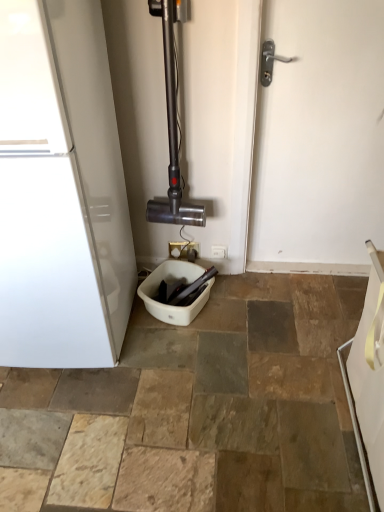
This screenshot has height=512, width=384. I want to click on metallic vacuum cleaner at center, so click(173, 124).

How much space does white plastic electric outlet at center, which is counted as the first electric outlet, starting from the left, occupy horizontally?

The width of white plastic electric outlet at center, which is counted as the first electric outlet, starting from the left, is 0.39 inches.

Locate an element on the screen. The height and width of the screenshot is (512, 384). white plastic electric outlet at center, the 2th electric outlet from the left is located at coordinates (219, 252).

Based on the photo, in order to face white plastic toilet bowl at center, should I rotate leftwards or rightwards?

To align with it, rotate left about 2.483°.

Image resolution: width=384 pixels, height=512 pixels. Identify the location of metallic vacuum cleaner at center. (173, 124).

Find the location of `home appliance located above the white plastic electric outlet at center, the second electric outlet positioned from the right (from a real-world perspective)`. home appliance located above the white plastic electric outlet at center, the second electric outlet positioned from the right (from a real-world perspective) is located at coordinates (60, 190).

In the image, is white plastic electric outlet at center, which is counted as the first electric outlet, starting from the left, positioned in front of or behind white glossy refrigerator at left?

white plastic electric outlet at center, which is counted as the first electric outlet, starting from the left, is behind white glossy refrigerator at left.

From a real-world perspective, between white plastic electric outlet at center, which is counted as the first electric outlet, starting from the left, and white glossy refrigerator at left, who is vertically higher?

From a 3D spatial view, white glossy refrigerator at left is above.

Where is `the 1st electric outlet directly beneath the white matte door at center (from a real-world perspective)`? Image resolution: width=384 pixels, height=512 pixels. the 1st electric outlet directly beneath the white matte door at center (from a real-world perspective) is located at coordinates (184, 250).

Considering the sizes of objects white plastic electric outlet at center, which is counted as the first electric outlet, starting from the left, and white matte door at center in the image provided, who is bigger, white plastic electric outlet at center, which is counted as the first electric outlet, starting from the left, or white matte door at center?

Bigger between the two is white matte door at center.

Would you say white matte door at center is part of white plastic electric outlet at center, the second electric outlet positioned from the right,'s contents?

No, white matte door at center is located outside of white plastic electric outlet at center, the second electric outlet positioned from the right.

Can you tell me how much white plastic electric outlet at center, which is counted as the first electric outlet, starting from the left, and white matte door at center differ in facing direction?

white plastic electric outlet at center, which is counted as the first electric outlet, starting from the left, and white matte door at center are facing 0.605 degrees away from each other.

Is white matte door at center directly adjacent to white glossy refrigerator at left?

No, white matte door at center is not making contact with white glossy refrigerator at left.

From the picture: From the image's perspective, which is above, white matte door at center or white glossy refrigerator at left?

From the image's view, white matte door at center is above.

Is white matte door at center in front of white glossy refrigerator at left?

No, white matte door at center is further to the viewer.

Could you tell me if white matte door at center is turned towards white glossy refrigerator at left?

No, white matte door at center does not turn towards white glossy refrigerator at left.

Are metallic vacuum cleaner at center and white plastic electric outlet at center, the first electric outlet positioned from the right, beside each other?

No.

Looking at their sizes, would you say metallic vacuum cleaner at center is wider or thinner than white plastic electric outlet at center, the first electric outlet positioned from the right?

In the image, metallic vacuum cleaner at center appears to be wider than white plastic electric outlet at center, the first electric outlet positioned from the right.

Which of these two, metallic vacuum cleaner at center or white plastic electric outlet at center, the first electric outlet positioned from the right, is smaller?

Smaller between the two is white plastic electric outlet at center, the first electric outlet positioned from the right.

Could you tell me if metallic vacuum cleaner at center is turned towards white plastic electric outlet at center, the first electric outlet positioned from the right?

No, metallic vacuum cleaner at center is not oriented towards white plastic electric outlet at center, the first electric outlet positioned from the right.

From the image's perspective, which object appears higher, white plastic electric outlet at center, the first electric outlet positioned from the right, or white plastic toilet bowl at center?

white plastic electric outlet at center, the first electric outlet positioned from the right, appears higher in the image.

From a real-world perspective, which object stands above the other?

white plastic electric outlet at center, the 2th electric outlet from the left, from a real-world perspective.

Would you say white plastic electric outlet at center, the 2th electric outlet from the left, is outside white plastic toilet bowl at center?

Indeed, white plastic electric outlet at center, the 2th electric outlet from the left, is completely outside white plastic toilet bowl at center.

Which of these two, white plastic electric outlet at center, the first electric outlet positioned from the right, or white plastic toilet bowl at center, is smaller?

white plastic electric outlet at center, the first electric outlet positioned from the right, is smaller.

Identify the location of toilet bowl below the metallic vacuum cleaner at center (from the image's perspective). coord(170,305).

Does metallic vacuum cleaner at center come in front of white plastic toilet bowl at center?

Yes, metallic vacuum cleaner at center is in front of white plastic toilet bowl at center.

From the image's perspective, which is below, metallic vacuum cleaner at center or white plastic toilet bowl at center?

From the image's view, white plastic toilet bowl at center is below.

In the image, is metallic vacuum cleaner at center on the left side or the right side of white plastic toilet bowl at center?

metallic vacuum cleaner at center is positioned on white plastic toilet bowl at center's left side.

Considering the sizes of white glossy towel at lower right and white glossy refrigerator at left in the image, is white glossy towel at lower right bigger or smaller than white glossy refrigerator at left?

In the image, white glossy towel at lower right appears to be smaller than white glossy refrigerator at left.

Based on the photo, who is more distant, white glossy towel at lower right or white glossy refrigerator at left?

white glossy refrigerator at left is more distant.

What are the coordinates of `home appliance on the left side of white glossy towel at lower right` in the screenshot? It's located at (60, 190).

Which point is more distant from viewer, (376, 414) or (35, 45)?

Positioned behind is point (376, 414).

Where is `home appliance in front of the white plastic electric outlet at center, the second electric outlet positioned from the right`? The height and width of the screenshot is (512, 384). home appliance in front of the white plastic electric outlet at center, the second electric outlet positioned from the right is located at coordinates (60, 190).

At what (x,y) coordinates should I click in order to perform the action: click on door lying on the right of white plastic electric outlet at center, which is counted as the first electric outlet, starting from the left. Please return your answer as a coordinate pair (x, y). The width and height of the screenshot is (384, 512). Looking at the image, I should click on (320, 137).

Considering their positions, is white glossy refrigerator at left positioned further to metallic vacuum cleaner at center than white plastic toilet bowl at center?

The object further to metallic vacuum cleaner at center is white glossy refrigerator at left.

Based on their spatial positions, is white glossy towel at lower right or white matte door at center closer to metallic vacuum cleaner at center?

white matte door at center is positioned closer to the anchor metallic vacuum cleaner at center.

Looking at the image, which one is located further to white matte door at center, white plastic toilet bowl at center or white glossy refrigerator at left?

The object further to white matte door at center is white glossy refrigerator at left.

From the image, which object appears to be nearer to white plastic toilet bowl at center, white plastic electric outlet at center, the 2th electric outlet from the left, or metallic vacuum cleaner at center?

Based on the image, white plastic electric outlet at center, the 2th electric outlet from the left, appears to be nearer to white plastic toilet bowl at center.

Considering their positions, is white plastic electric outlet at center, the second electric outlet positioned from the right, positioned closer to white glossy towel at lower right than white plastic electric outlet at center, the first electric outlet positioned from the right?

white plastic electric outlet at center, the first electric outlet positioned from the right, lies closer to white glossy towel at lower right than the other object.

Based on the photo, considering their positions, is white glossy towel at lower right positioned further to white matte door at center than white plastic electric outlet at center, which is counted as the first electric outlet, starting from the left?

white plastic electric outlet at center, which is counted as the first electric outlet, starting from the left, lies further to white matte door at center than the other object.

Looking at this image, which object lies nearer to the anchor point white matte door at center, white plastic electric outlet at center, which is counted as the first electric outlet, starting from the left, or white plastic electric outlet at center, the 2th electric outlet from the left?

white plastic electric outlet at center, the 2th electric outlet from the left, is positioned closer to the anchor white matte door at center.

Estimate the real-world distances between objects in this image. Which object is further from white glossy refrigerator at left, white plastic toilet bowl at center or white matte door at center?

white matte door at center lies further to white glossy refrigerator at left than the other object.

The width and height of the screenshot is (384, 512). Find the location of `toilet bowl located between white glossy refrigerator at left and white plastic electric outlet at center, the 2th electric outlet from the left, in the depth direction`. toilet bowl located between white glossy refrigerator at left and white plastic electric outlet at center, the 2th electric outlet from the left, in the depth direction is located at coordinates click(x=170, y=305).

In order to click on pipe between white glossy towel at lower right and white plastic electric outlet at center, the 2th electric outlet from the left, in the front-back direction in this screenshot , I will do `click(173, 124)`.

Identify the location of toilet bowl between white glossy refrigerator at left and white plastic electric outlet at center, the second electric outlet positioned from the right, from front to back. coord(170,305).

Where is `pipe located between white glossy towel at lower right and white plastic electric outlet at center, which is counted as the first electric outlet, starting from the left, in the depth direction`? pipe located between white glossy towel at lower right and white plastic electric outlet at center, which is counted as the first electric outlet, starting from the left, in the depth direction is located at coordinates (173, 124).